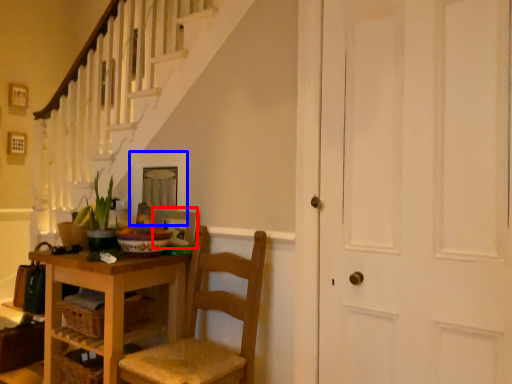
Question: Which object appears closest to the camera in this image, picture frame (highlighted by a red box) or picture frame (highlighted by a blue box)?

Choices:
 (A) picture frame
 (B) picture frame

Answer: (A)